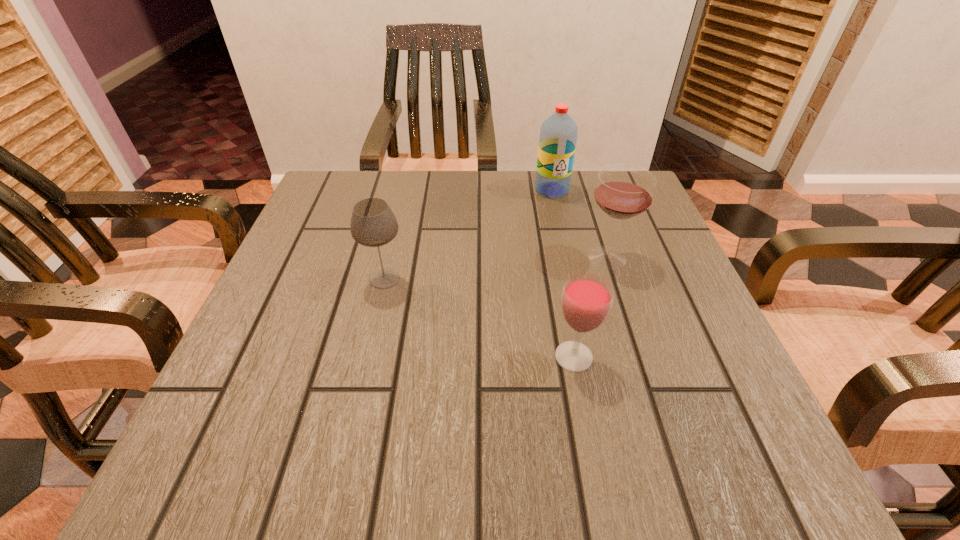
The width and height of the screenshot is (960, 540). I want to click on unoccupied area between the water bottle and the rightmost wineglass, so click(x=580, y=224).

This screenshot has height=540, width=960. What are the coordinates of `empty location between the nearest wineglass and the leftmost object` in the screenshot? It's located at (479, 318).

This screenshot has width=960, height=540. I want to click on free space between the rightmost wineglass and the water bottle, so click(x=580, y=224).

Find the location of `unoccupied area between the nearest wineglass and the water bottle`. unoccupied area between the nearest wineglass and the water bottle is located at coordinates (563, 273).

This screenshot has height=540, width=960. In order to click on vacant space that's between the farthest object and the nearest wineglass in this screenshot , I will do `click(563, 273)`.

Find the location of a particular element. Image resolution: width=960 pixels, height=540 pixels. blank region between the leftmost wineglass and the rightmost wineglass is located at coordinates (496, 268).

At what (x,y) coordinates should I click in order to perform the action: click on free space between the second wineglass from left to right and the farthest object. Please return your answer as a coordinate pair (x, y). The image size is (960, 540). Looking at the image, I should click on click(x=563, y=273).

Where is `vacant space that is in between the water bottle and the leftmost object`? The image size is (960, 540). vacant space that is in between the water bottle and the leftmost object is located at coordinates (468, 234).

Choose which object is the third nearest neighbor to the farthest object. Please provide its 2D coordinates. Your answer should be formatted as a tuple, i.e. [(x, y)], where the tuple contains the x and y coordinates of a point satisfying the conditions above.

[(587, 298)]

Where is `object that stands as the third closest to the rightmost wineglass`? object that stands as the third closest to the rightmost wineglass is located at coordinates (373, 224).